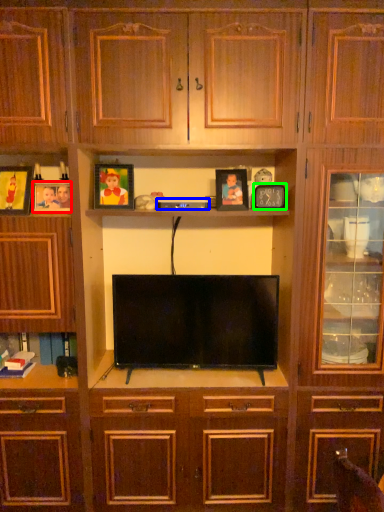
Question: Which object is the closest to the picture frame (highlighted by a red box)? Choose among these: appliance (highlighted by a blue box) or picture frame (highlighted by a green box).

Choices:
 (A) appliance
 (B) picture frame

Answer: (A)